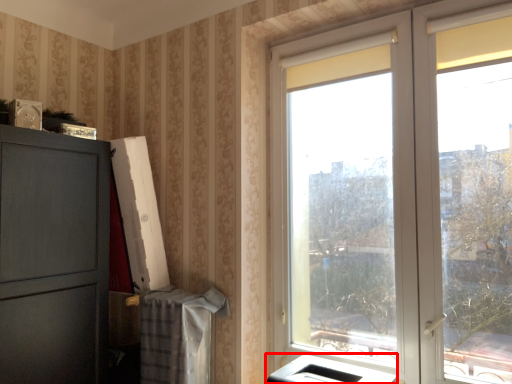
Question: Where is appliance (annotated by the red box) located in relation to window in the image?

Choices:
 (A) left
 (B) right

Answer: (A)